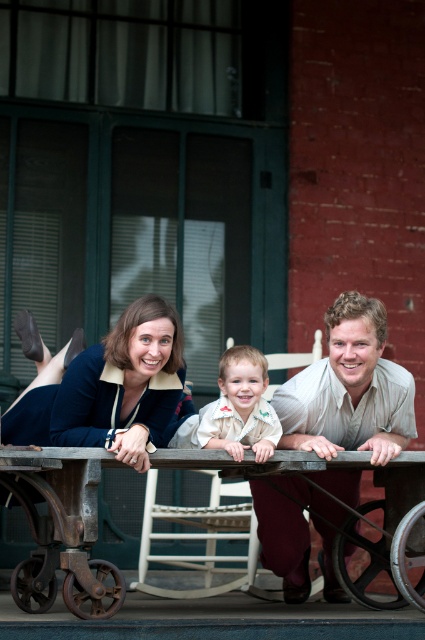
Looking at this image, does matte blue blouse at center have a larger size compared to light beige shirt at center?

Yes.

I want to click on matte blue blouse at center, so click(124, 381).

This screenshot has height=640, width=425. I want to click on matte blue blouse at center, so click(x=124, y=381).

Which of these two, matte blue shirt at center or light beige shirt at center, stands shorter?

light beige shirt at center is shorter.

Does matte blue shirt at center have a larger size compared to light beige shirt at center?

Indeed, matte blue shirt at center has a larger size compared to light beige shirt at center.

Is point (158, 403) positioned after point (258, 406)?

Yes, point (158, 403) is farther from viewer.

This screenshot has width=425, height=640. In order to click on matte blue shirt at center in this screenshot , I will do `click(104, 384)`.

Which of these two, light brown wood table at center or light beige shirt at center, stands taller?

light brown wood table at center

Who is more distant from viewer, (334, 360) or (229, 422)?

Positioned behind is point (334, 360).

Who is more distant from viewer, [346,321] or [221,435]?

Positioned behind is point [346,321].

You are a GUI agent. You are given a task and a screenshot of the screen. Output one action in this format:
    pyautogui.click(x=<x>, y=<y>)
    Task: Click on the light brown wood table at center
    This screenshot has width=425, height=640.
    Given the screenshot: What is the action you would take?
    pyautogui.click(x=350, y=388)